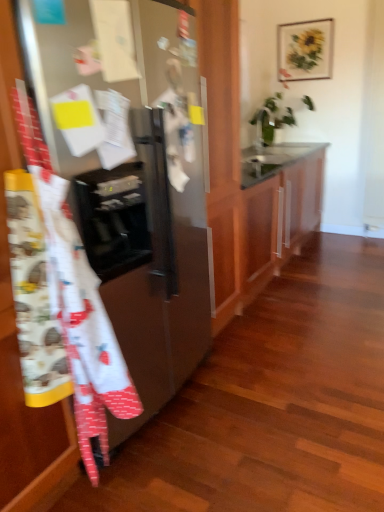
Question: Is white glossy sink at upper center oriented away from white cotton apron at left?

Choices:
 (A) yes
 (B) no

Answer: (B)

Question: Is white cotton apron at left a part of white glossy sink at upper center?

Choices:
 (A) no
 (B) yes

Answer: (A)

Question: From a real-world perspective, is white glossy sink at upper center under white cotton apron at left?

Choices:
 (A) yes
 (B) no

Answer: (B)

Question: From a real-world perspective, is white glossy sink at upper center over white cotton apron at left?

Choices:
 (A) yes
 (B) no

Answer: (A)

Question: Does white glossy sink at upper center come behind white cotton apron at left?

Choices:
 (A) yes
 (B) no

Answer: (A)

Question: In terms of size, does white cotton apron at left appear bigger or smaller than glossy wood cabinet at center?

Choices:
 (A) small
 (B) big

Answer: (A)

Question: Does point (54, 258) appear closer or farther from the camera than point (299, 216)?

Choices:
 (A) closer
 (B) farther

Answer: (A)

Question: In the image, is white cotton apron at left positioned in front of or behind glossy wood cabinet at center?

Choices:
 (A) front
 (B) behind

Answer: (A)

Question: Do you think white cotton apron at left is within glossy wood cabinet at center, or outside of it?

Choices:
 (A) inside
 (B) outside

Answer: (B)

Question: From the image's perspective, relative to satin silver refrigerator at left, is white glossy sink at upper center above or below?

Choices:
 (A) above
 (B) below

Answer: (A)

Question: Is white glossy sink at upper center in front of or behind satin silver refrigerator at left in the image?

Choices:
 (A) behind
 (B) front

Answer: (A)

Question: From a real-world perspective, is white glossy sink at upper center physically located above or below satin silver refrigerator at left?

Choices:
 (A) below
 (B) above

Answer: (B)

Question: Would you say white glossy sink at upper center is to the left or to the right of satin silver refrigerator at left in the picture?

Choices:
 (A) left
 (B) right

Answer: (B)

Question: Is glossy wood cabinet at center inside the boundaries of white cotton apron at left, or outside?

Choices:
 (A) inside
 (B) outside

Answer: (B)

Question: From a real-world perspective, is glossy wood cabinet at center positioned above or below white cotton apron at left?

Choices:
 (A) below
 (B) above

Answer: (A)